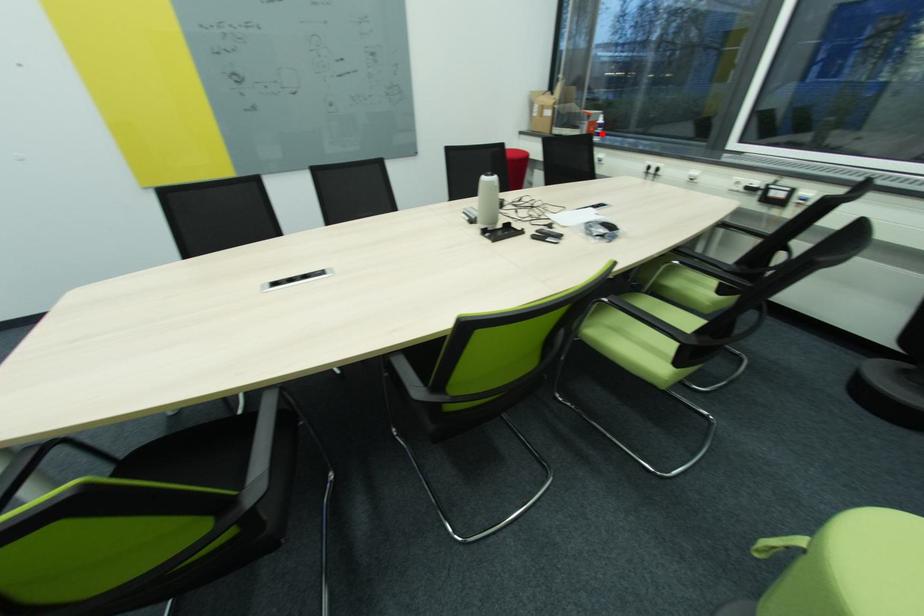
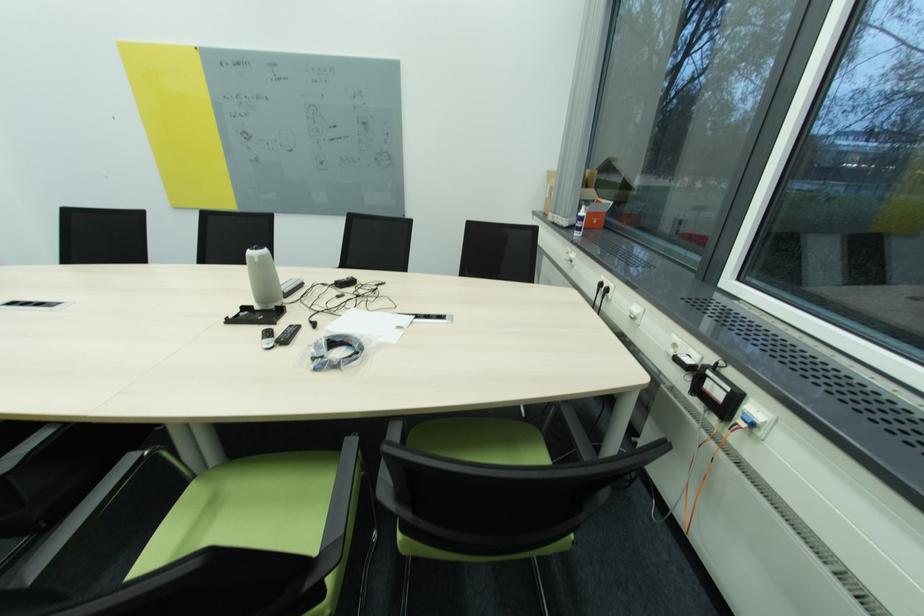
Question: I am providing you with two images of the same scene from different viewpoints. A red point is marked on the first image. At the location where the point appears in image 1, is it still visible in image 2?

Choices:
 (A) Yes
 (B) No

Answer: (A)